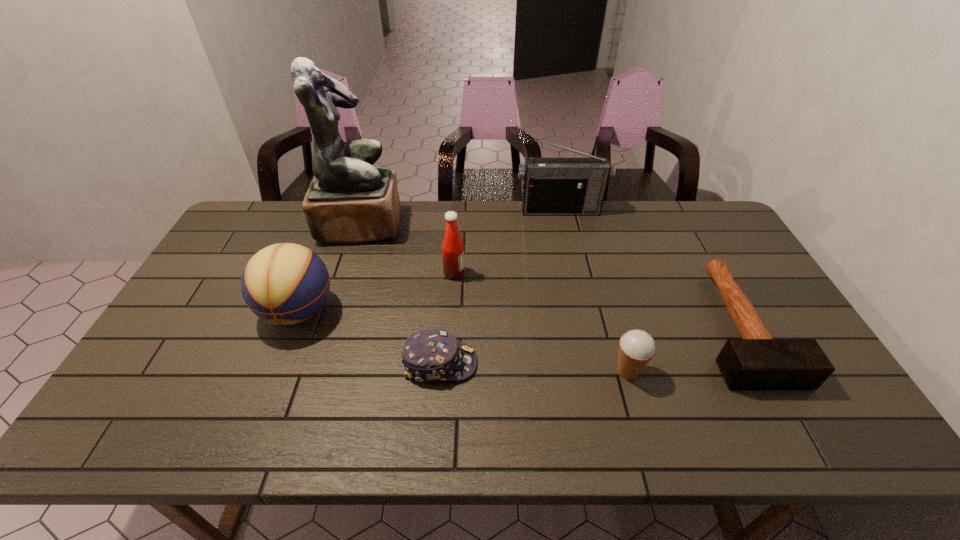
In the image, there is a desktop. In order to click on free space at the far left corner in this screenshot , I will do `click(274, 214)`.

In the image, there is a desktop. Find the location of `free region at the far right corner`. free region at the far right corner is located at coordinates (685, 231).

Where is `free space between the condiment and the fifth tallest object`? free space between the condiment and the fifth tallest object is located at coordinates (540, 322).

Identify the location of vacant space in between the headwear and the sculpture. (400, 294).

This screenshot has width=960, height=540. In order to click on vacant area that lies between the second tallest object and the sculpture in this screenshot , I will do `click(461, 217)`.

Locate an element on the screen. The width and height of the screenshot is (960, 540). unoccupied position between the sixth shortest object and the rightmost object is located at coordinates (649, 268).

Locate an element on the screen. free space between the condiment and the rightmost object is located at coordinates (595, 299).

The height and width of the screenshot is (540, 960). In order to click on free space between the condiment and the third shortest object in this screenshot , I will do `click(540, 322)`.

Where is `empty location between the mallet and the icecream`? empty location between the mallet and the icecream is located at coordinates (683, 348).

What are the coordinates of `free space between the sculpture and the basketball` in the screenshot? It's located at (329, 268).